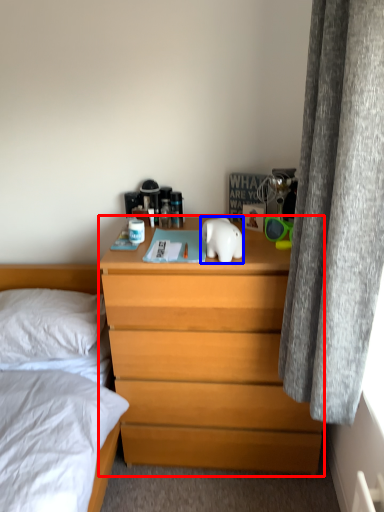
Question: Among these objects, which one is nearest to the camera, chest of drawers (highlighted by a red box) or animal (highlighted by a blue box)?

Choices:
 (A) chest of drawers
 (B) animal

Answer: (B)